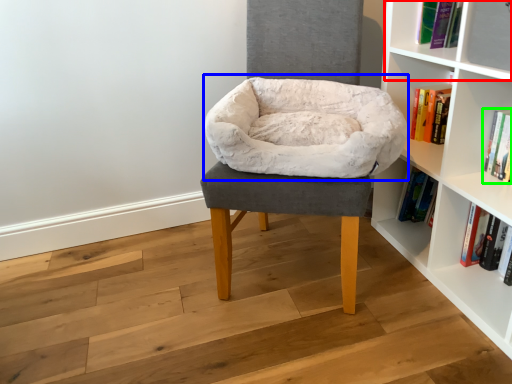
Question: Based on their relative distances, which object is nearer to cabinet (highlighted by a red box)? Choose from bean bag chair (highlighted by a blue box) and book (highlighted by a green box).

Choices:
 (A) bean bag chair
 (B) book

Answer: (B)